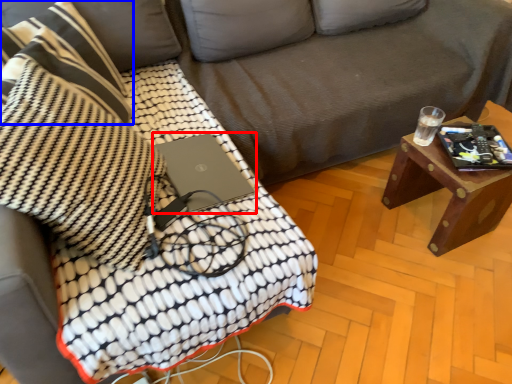
Question: Which object appears closest to the camera in this image, laptop (highlighted by a red box) or throw pillow (highlighted by a blue box)?

Choices:
 (A) laptop
 (B) throw pillow

Answer: (B)